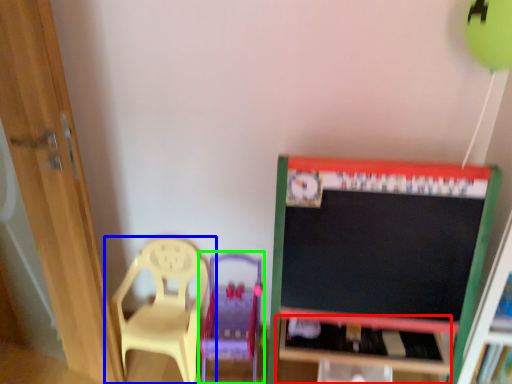
Question: Based on their relative distances, which object is nearer to table (highlighted by a red box)? Choose from chair (highlighted by a blue box) and swivel chair (highlighted by a green box).

Choices:
 (A) chair
 (B) swivel chair

Answer: (B)